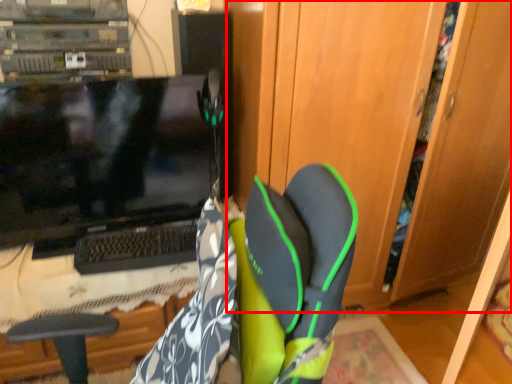
Question: Observing the image, what is the correct spatial positioning of dresser (annotated by the red box) in reference to computer monitor?

Choices:
 (A) left
 (B) right

Answer: (B)